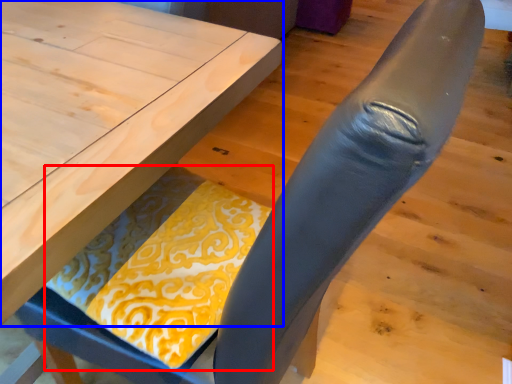
Question: Which of the following is the farthest to the observer, blanket (highlighted by a red box) or table (highlighted by a blue box)?

Choices:
 (A) blanket
 (B) table

Answer: (A)